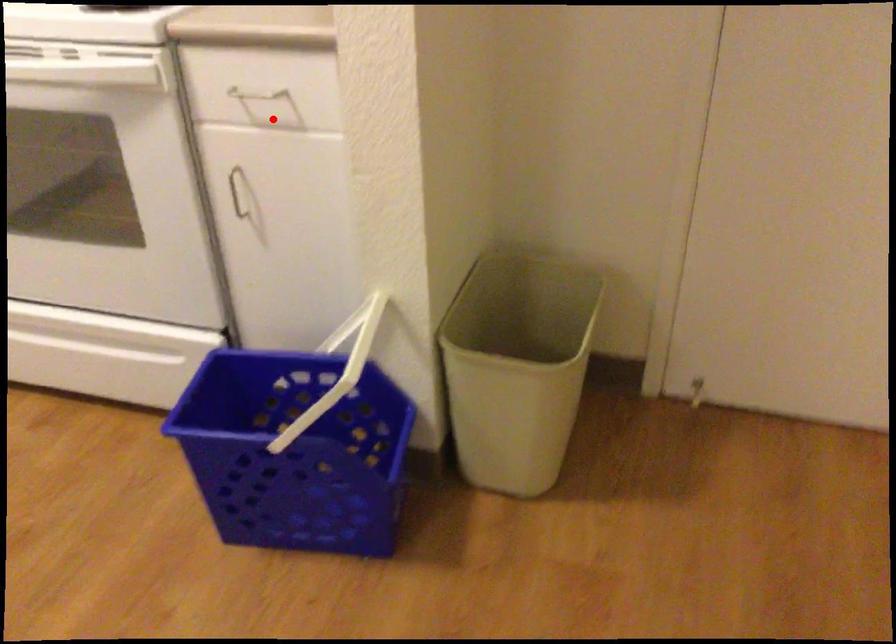
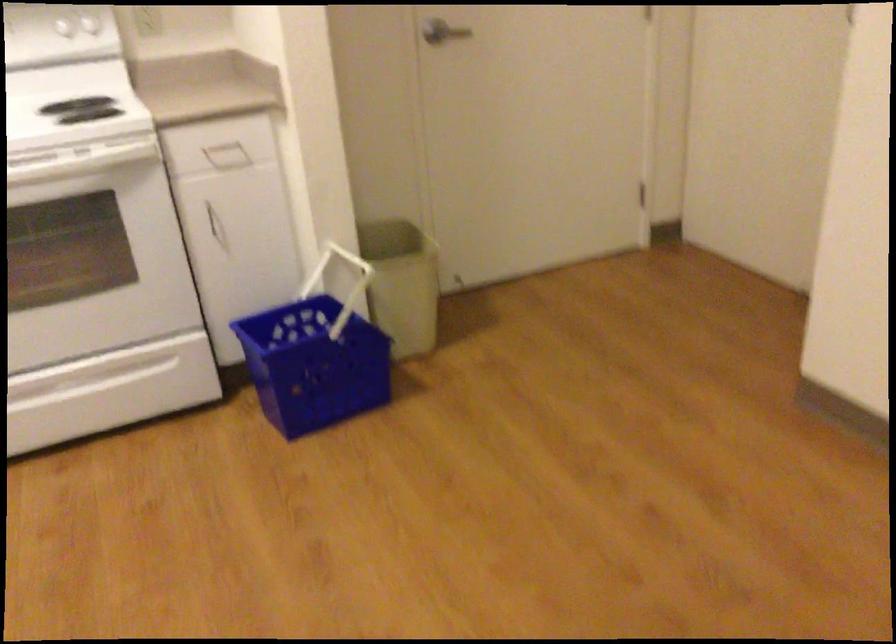
Locate, in the second image, the point that corresponds to the highlighted location in the first image.

(227, 156)